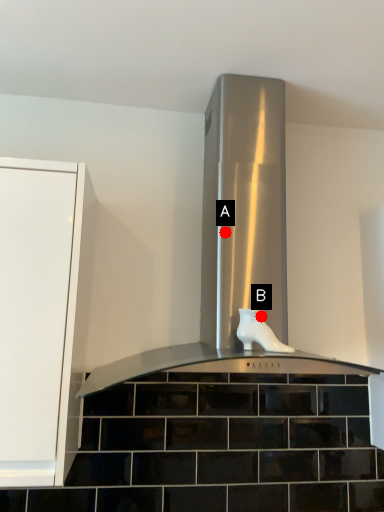
Question: Two points are circled on the image, labeled by A and B beside each circle. Which point appears closest to the camera in this image?

Choices:
 (A) A is closer
 (B) B is closer

Answer: (B)